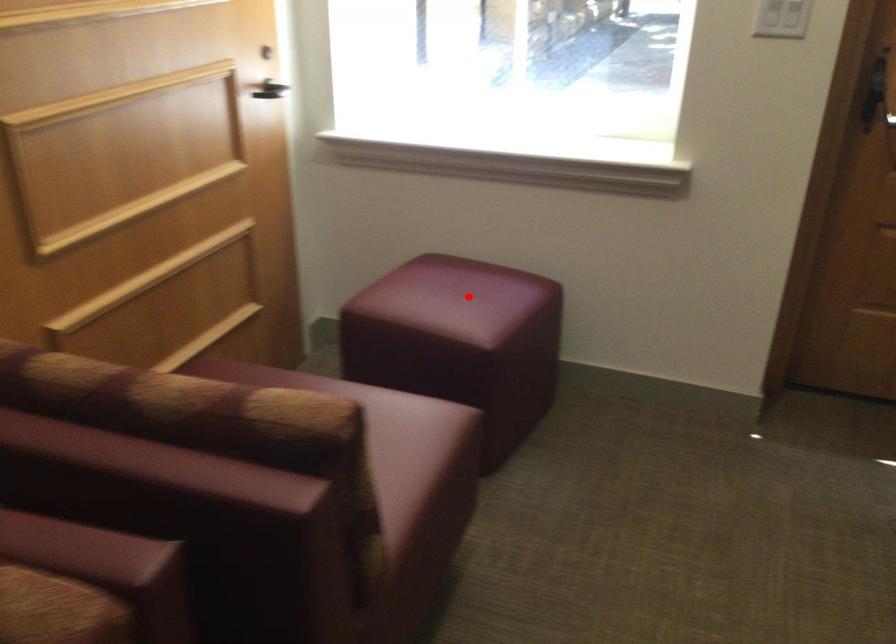
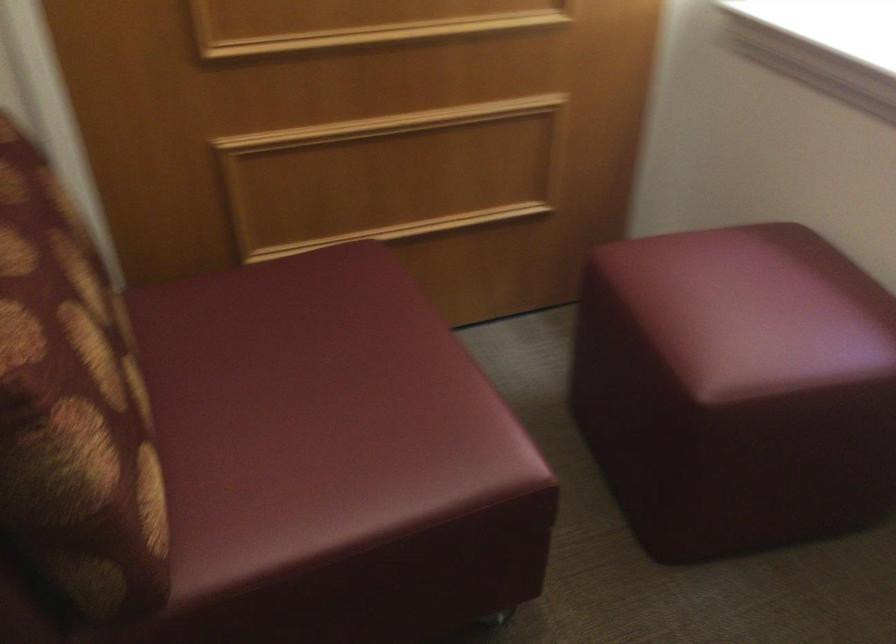
Find the pixel in the second image that matches the highlighted location in the first image.

(752, 308)